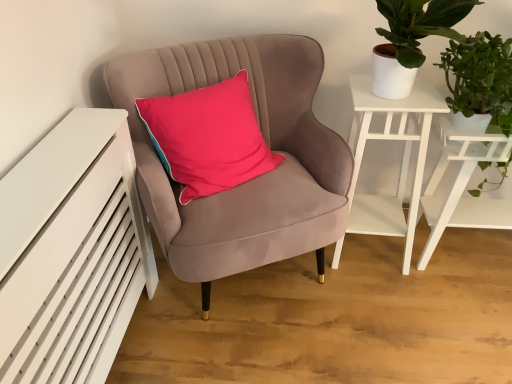
You are a GUI agent. You are given a task and a screenshot of the screen. Output one action in this format:
    pyautogui.click(x=<x>, y=<y>)
    Task: Click on the free region under white matte side table at upper right (from a real-world perspective)
    This screenshot has width=512, height=384.
    Given the screenshot: What is the action you would take?
    pyautogui.click(x=370, y=251)